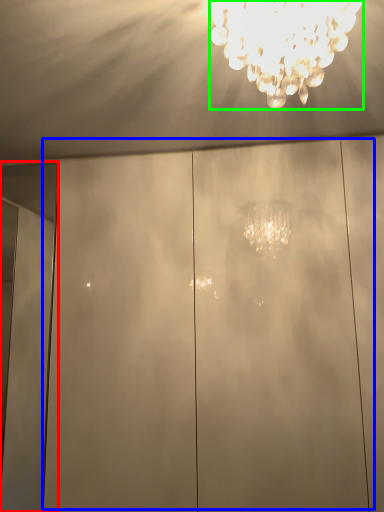
Question: Estimate the real-world distances between objects in this image. Which object is farther from door (highlighted by a red box), glass door (highlighted by a blue box) or lamp (highlighted by a green box)?

Choices:
 (A) glass door
 (B) lamp

Answer: (B)